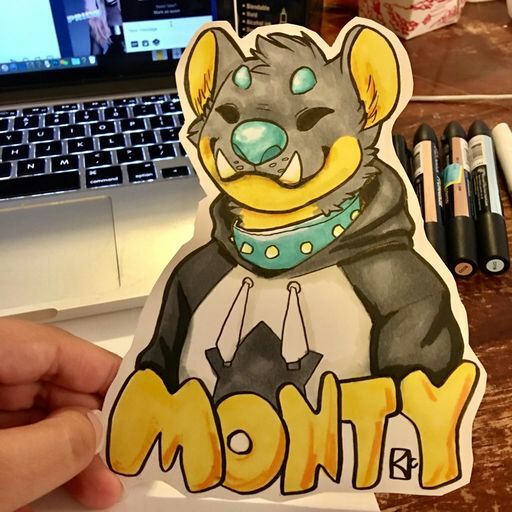
Where is `mousepad`? The width and height of the screenshot is (512, 512). mousepad is located at coordinates (57, 254).